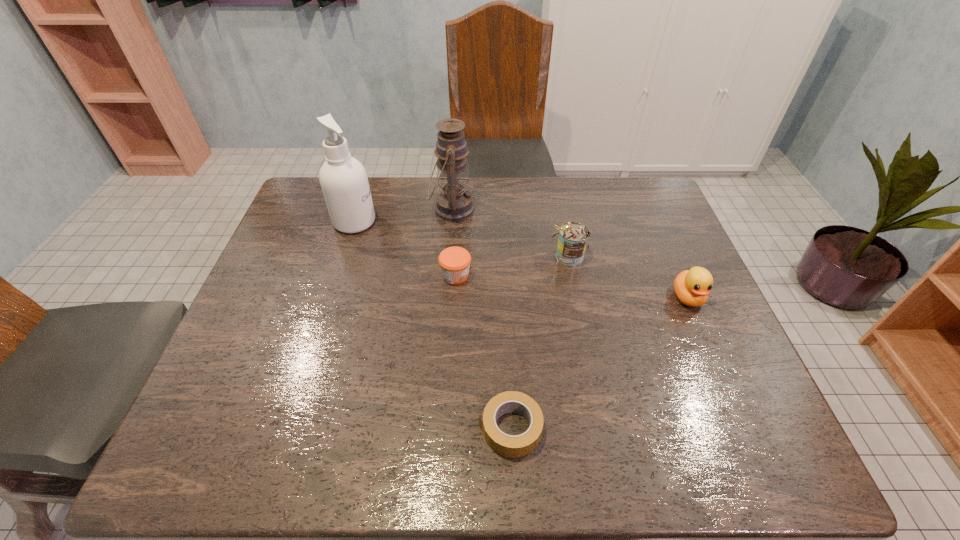
Identify the location of object that is positioned at the left edge. (343, 179).

Where is `object that is at the right edge`? object that is at the right edge is located at coordinates (692, 287).

The width and height of the screenshot is (960, 540). Identify the location of object that is at the far left corner. (343, 179).

Find the location of a particular element. This screenshot has width=960, height=540. free spot at the far edge of the desktop is located at coordinates (583, 222).

Locate an element on the screen. Image resolution: width=960 pixels, height=540 pixels. vacant space at the near edge of the desktop is located at coordinates (342, 465).

At what (x,y) coordinates should I click in order to perform the action: click on vacant region at the left edge of the desktop. Please return your answer as a coordinate pair (x, y). The image size is (960, 540). Looking at the image, I should click on click(x=249, y=309).

In the image, there is a desktop. Where is `free space at the right edge`? free space at the right edge is located at coordinates (657, 223).

The height and width of the screenshot is (540, 960). What are the coordinates of `blank space at the far right corner of the desktop` in the screenshot? It's located at (618, 214).

At what (x,y) coordinates should I click in order to perform the action: click on free point between the fourth object from left to right and the oil lamp. Please return your answer as a coordinate pair (x, y). The image size is (960, 540). Looking at the image, I should click on (481, 319).

In order to click on unoccupied area between the second shortest object and the nearest object in this screenshot , I will do `click(483, 352)`.